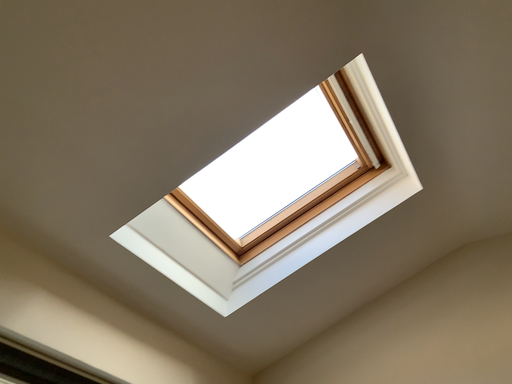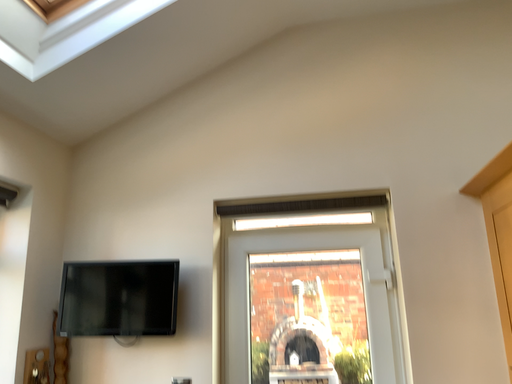
Question: How did the camera likely rotate when shooting the video?

Choices:
 (A) rotated right
 (B) rotated left

Answer: (A)